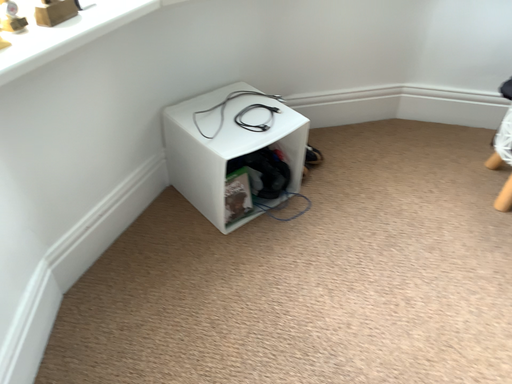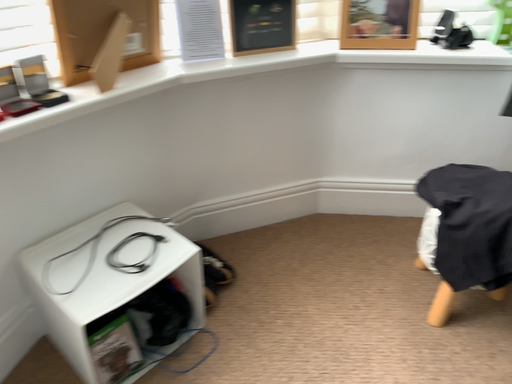
Question: How did the camera likely rotate when shooting the video?

Choices:
 (A) rotated upward
 (B) rotated downward

Answer: (A)